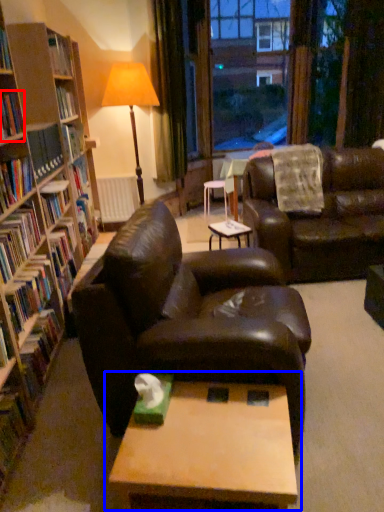
Question: Which point is further to the camera, book (highlighted by a red box) or table (highlighted by a blue box)?

Choices:
 (A) book
 (B) table

Answer: (A)